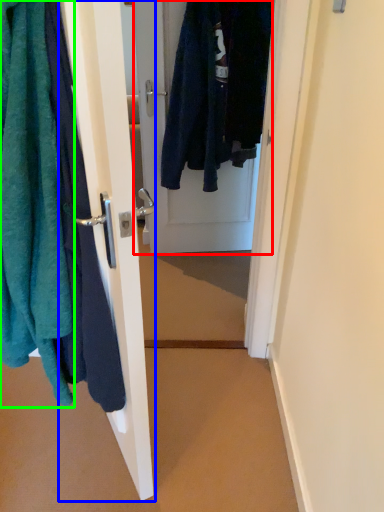
Question: Considering the real-world distances, which object is farthest from door (highlighted by a red box)? door (highlighted by a blue box) or towel (highlighted by a green box)?

Choices:
 (A) door
 (B) towel

Answer: (B)